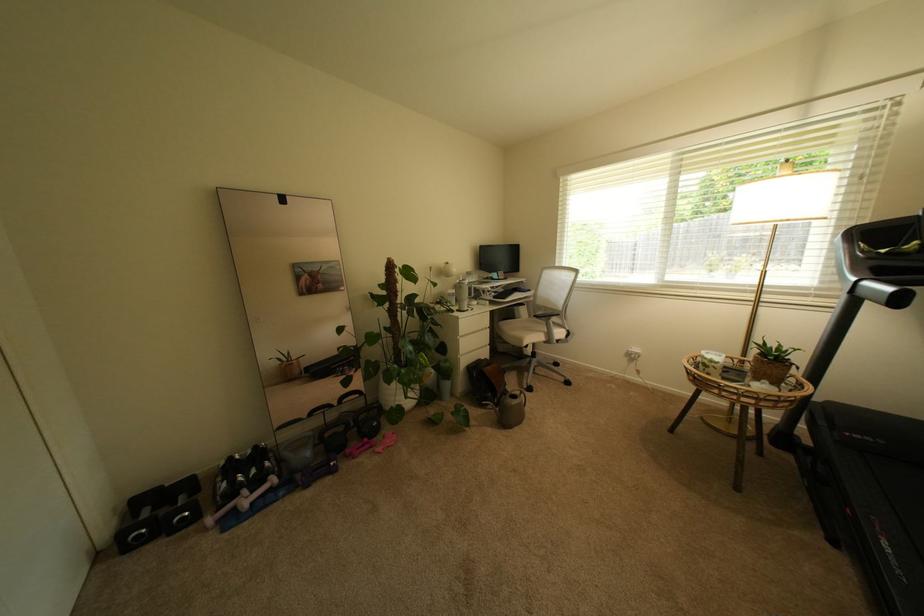
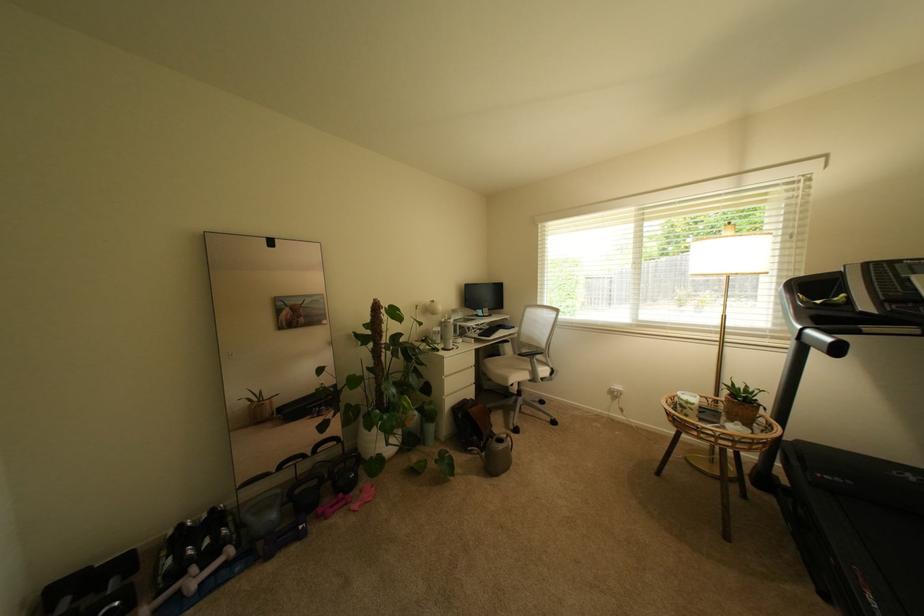
The point at (638, 351) is marked in the first image. Where is the corresponding point in the second image?

(622, 389)